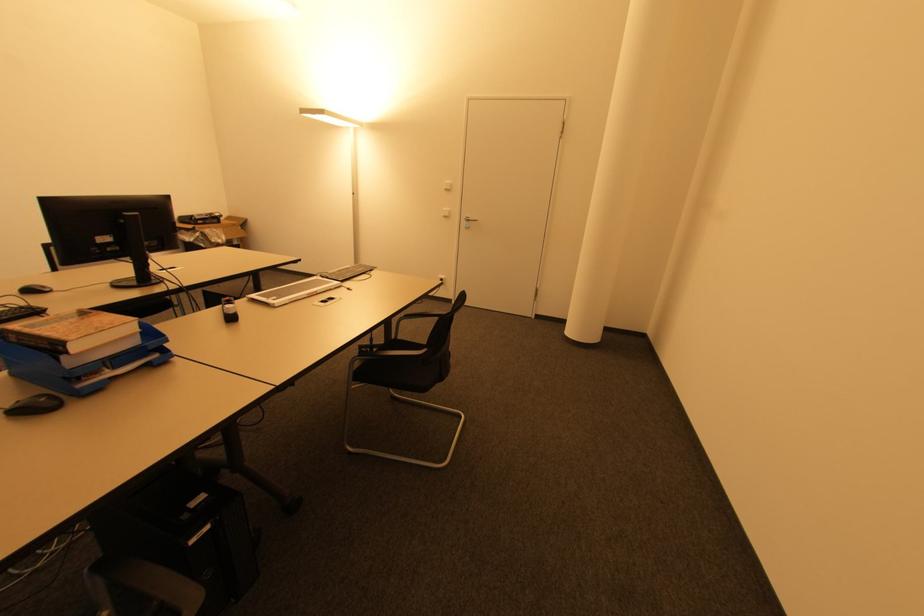
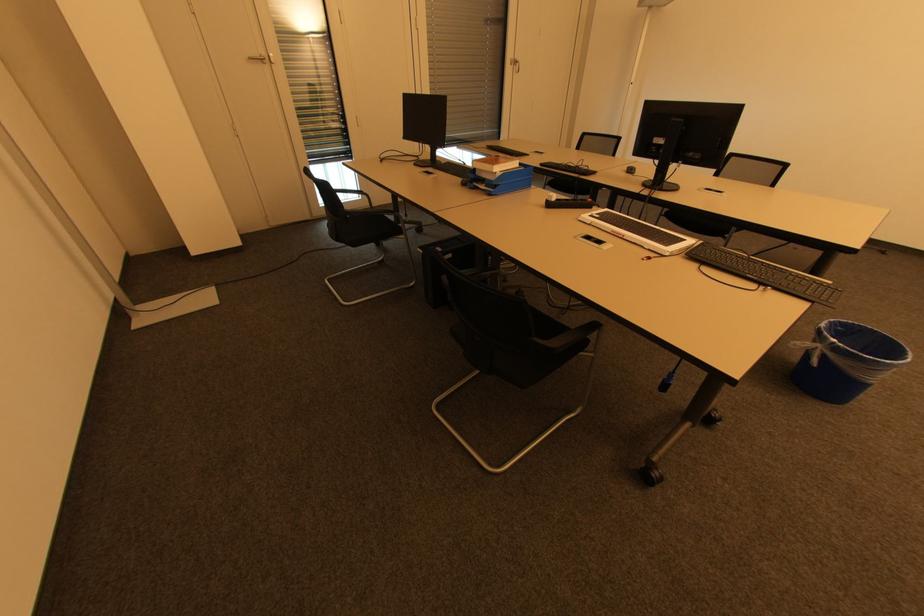
Locate, in the second image, the point that corresponds to [53,292] in the first image.

(634, 174)